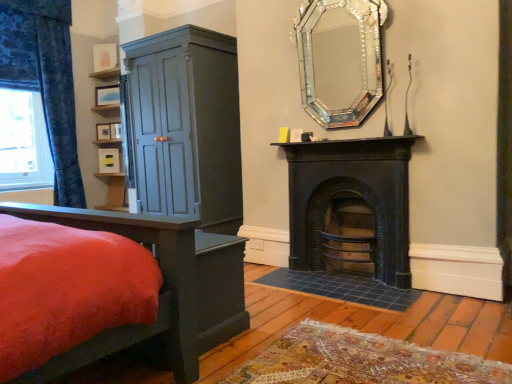
Question: In terms of width, does matte blue cabinet at left look wider or thinner when compared to blue floral fabric curtain at left?

Choices:
 (A) thin
 (B) wide

Answer: (B)

Question: From the image's perspective, is matte blue cabinet at left above or below blue floral fabric curtain at left?

Choices:
 (A) above
 (B) below

Answer: (B)

Question: Estimate the real-world distances between objects in this image. Which object is farther from the matte blue cabinet at left?

Choices:
 (A) matte wooden picture frame at upper left, acting as the first picture frame starting from the top
 (B) matte wooden picture frame at upper left, marked as the 2th picture frame in a top-to-bottom arrangement
 (C) blue floral fabric curtain at left
 (D) velvet red bed at lower left
 (E) matte white picture frame at upper left, arranged as the 4th picture frame when viewed from the top

Answer: (A)

Question: Which object is the farthest from the matte wooden picture frame at upper left, positioned as the 4th picture frame in bottom-to-top order?

Choices:
 (A) matte wood shelf at upper left
 (B) matte black picture frame at center, which is counted as the third picture frame, starting from the bottom
 (C) black cast iron fireplace at upper center, arranged as the 1th fireplace when viewed from the top
 (D) matte yellow picture frame at center, positioned as the first picture frame in bottom-to-top order
 (E) blue floral fabric curtain at left

Answer: (C)